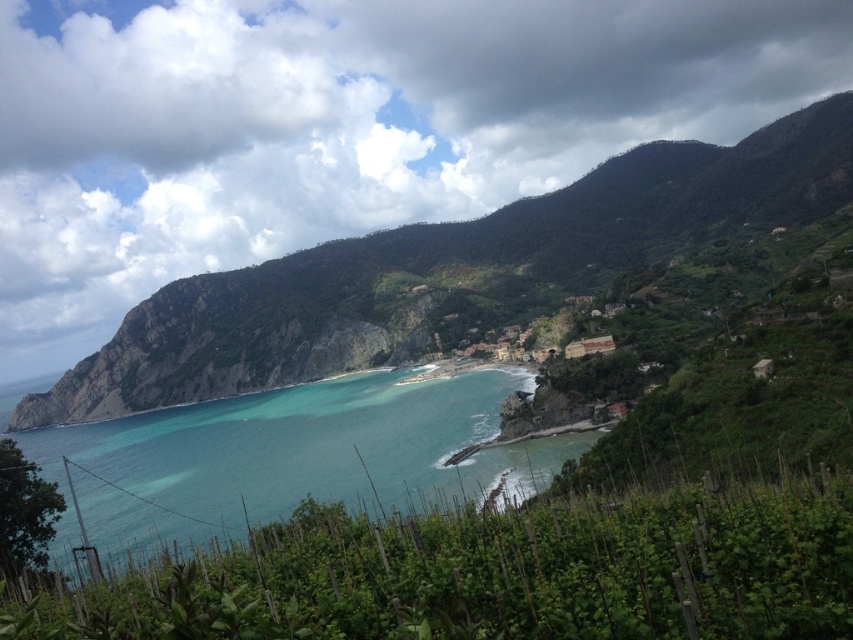
Question: Which point is closer to the camera?

Choices:
 (A) (171, 285)
 (B) (119, 497)

Answer: (B)

Question: Which object is farther from the camera taking this photo?

Choices:
 (A) green grassy mountain at center
 (B) clear blue water at center

Answer: (A)

Question: Which point is farther from the camera taking this photo?

Choices:
 (A) (16, 387)
 (B) (646, 531)
 (C) (523, 237)

Answer: (A)

Question: Can you confirm if green leafy vines at lower center is positioned to the left of green grassy mountain at center?

Choices:
 (A) no
 (B) yes

Answer: (A)

Question: Can you confirm if green leafy vines at lower center is wider than clear blue water at center?

Choices:
 (A) no
 (B) yes

Answer: (A)

Question: Where is green grassy mountain at center located in relation to clear blue water at center in the image?

Choices:
 (A) below
 (B) above

Answer: (B)